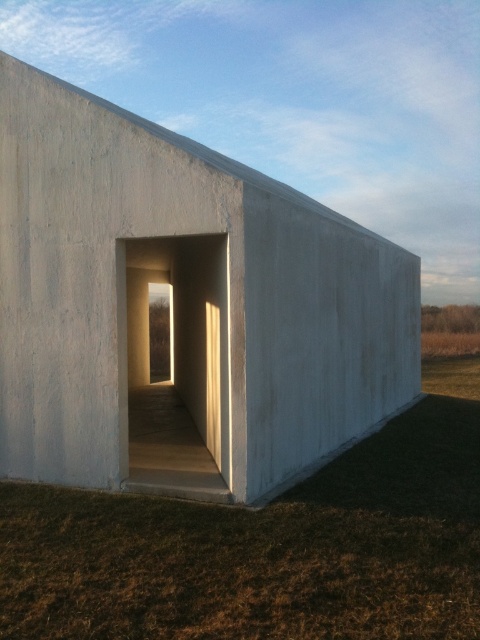
You are standing outside the minimalist structure and want to walk towards the white concrete wall at center. Which direction should you move relative to the brown grass at lower center?

To reach the white concrete wall at center, you should move towards it from the brown grass at lower center since the white concrete wall at center is positioned over brown grass at lower center.

You are standing in front of the minimalist architectural structure described. There is a point marked at coordinates [181,308]. What does this point represent?

The point at coordinates [181,308] indicates the white concrete wall at center.

You are standing in front of the minimalist building and want to walk towards the brown grass at lower center. Which direction should you face to move directly towards it from the white concrete wall at center?

Since the white concrete wall at center is to the left of brown grass at lower center, you should face to the right to move directly towards the brown grass at lower center from the white concrete wall at center.